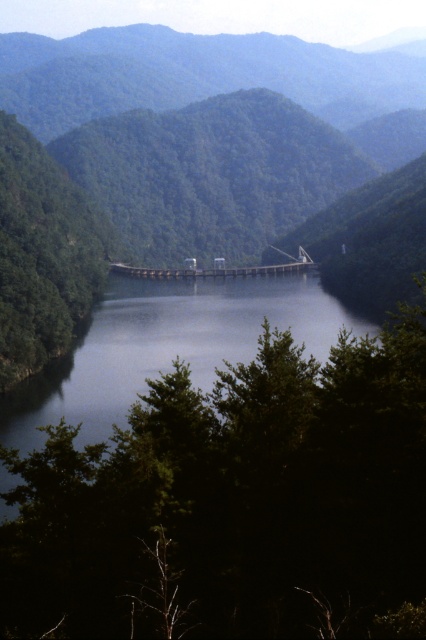
Question: Is green matte tree at center smaller than concrete bridge at center?

Choices:
 (A) no
 (B) yes

Answer: (A)

Question: Does green matte tree at center appear over concrete bridge at center?

Choices:
 (A) yes
 (B) no

Answer: (A)

Question: Can you confirm if green matte tree at center is positioned above concrete bridge at center?

Choices:
 (A) yes
 (B) no

Answer: (A)

Question: Which point appears closest to the camera in this image?

Choices:
 (A) (144, 276)
 (B) (161, 589)
 (C) (69, 211)

Answer: (B)

Question: Among these objects, which one is nearest to the camera?

Choices:
 (A) green leafy tree at center
 (B) green matte tree at center

Answer: (A)

Question: Which point appears closest to the camera in this image?

Choices:
 (A) (31, 292)
 (B) (152, 276)

Answer: (A)